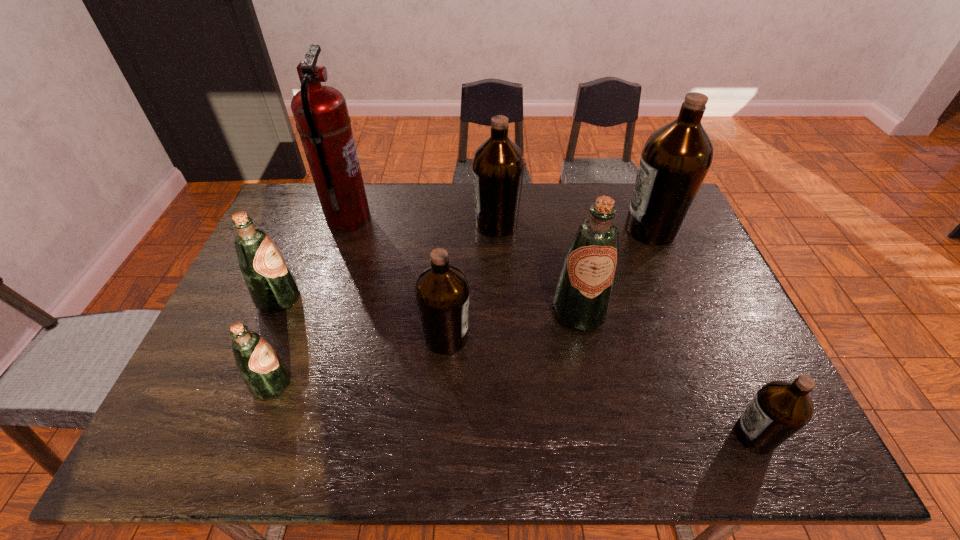
This screenshot has height=540, width=960. Identify the location of fire extinguisher. (322, 120).

Find the location of `the biggest brown olive oil`. the biggest brown olive oil is located at coordinates (675, 160).

The image size is (960, 540). In order to click on the seventh shortest object in this screenshot , I will do `click(675, 160)`.

I want to click on the third smallest brown olive oil, so click(498, 165).

The width and height of the screenshot is (960, 540). I want to click on the fifth olive oil from left to right, so click(582, 297).

Where is `the rightmost green olive oil`? The image size is (960, 540). the rightmost green olive oil is located at coordinates (582, 297).

Where is `the second biggest green olive oil`? The height and width of the screenshot is (540, 960). the second biggest green olive oil is located at coordinates (273, 288).

Identify the location of the third farthest brown olive oil. (442, 291).

The width and height of the screenshot is (960, 540). Identify the location of the seventh farthest object. (265, 374).

Find the location of a particular element. The height and width of the screenshot is (540, 960). the second nearest olive oil is located at coordinates pyautogui.click(x=265, y=374).